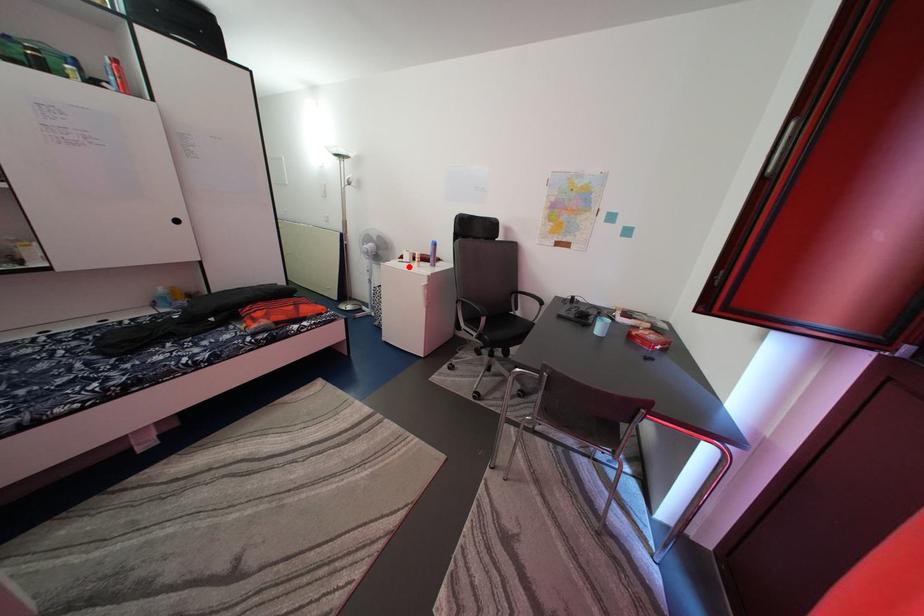
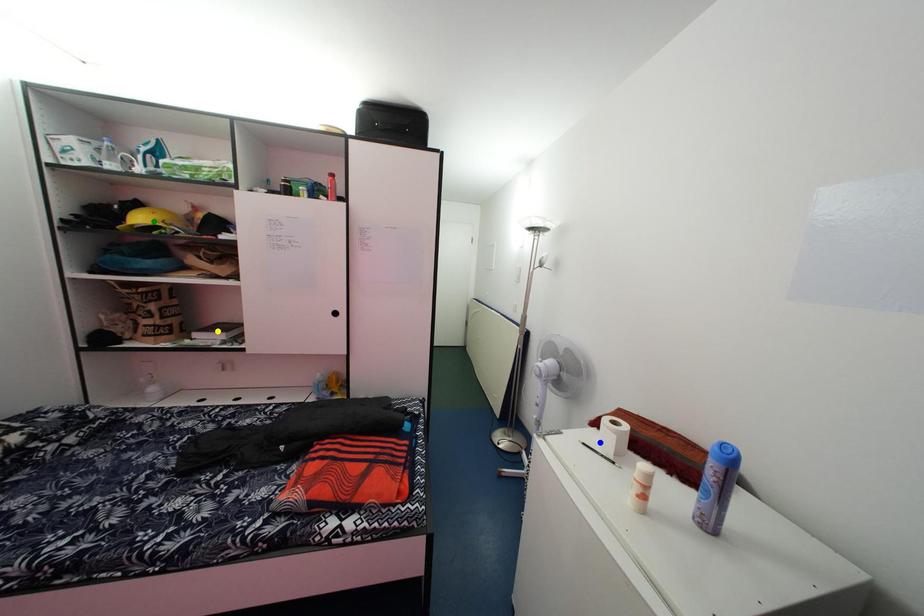
Question: I am providing you with two images of the same scene from different viewpoints. A red point is marked on the first image. You are given multiple points on the second image. Which point in image 2 represents the same 3d spot as the red point in image 1?

Choices:
 (A) yellow point
 (B) green point
 (C) blue point

Answer: (C)